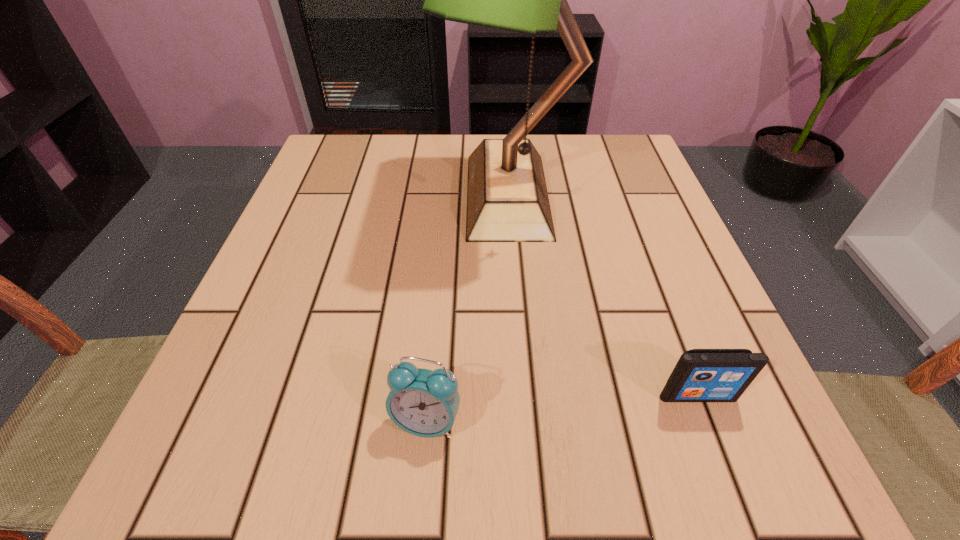
This screenshot has width=960, height=540. I want to click on free spot that satisfies the following two spatial constraints: 1. on the metallic stand of the table lamp; 2. on the face of the second shortest object, so click(x=525, y=421).

The image size is (960, 540). I want to click on free space that satisfies the following two spatial constraints: 1. on the metallic stand of the farthest object; 2. on the face of the alarm clock, so click(x=525, y=421).

Identify the location of vacant space that satisfies the following two spatial constraints: 1. on the metallic stand of the farthest object; 2. on the face of the alarm clock. The width and height of the screenshot is (960, 540). (525, 421).